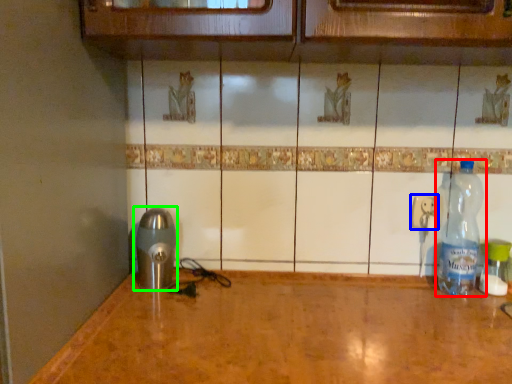
Question: Estimate the real-world distances between objects in this image. Which object is closer to bottle (highlighted by a red box), electric outlet (highlighted by a blue box) or appliance (highlighted by a green box)?

Choices:
 (A) electric outlet
 (B) appliance

Answer: (A)